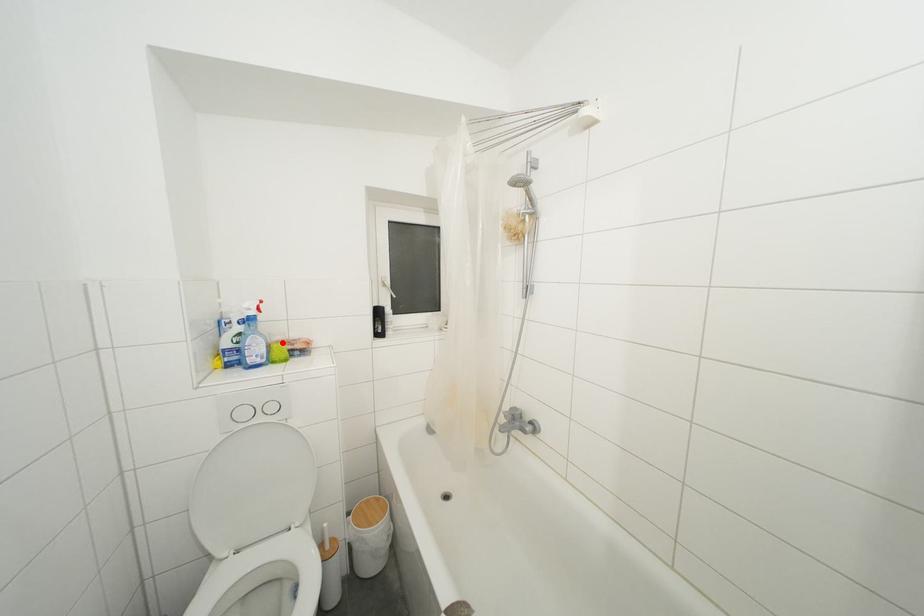
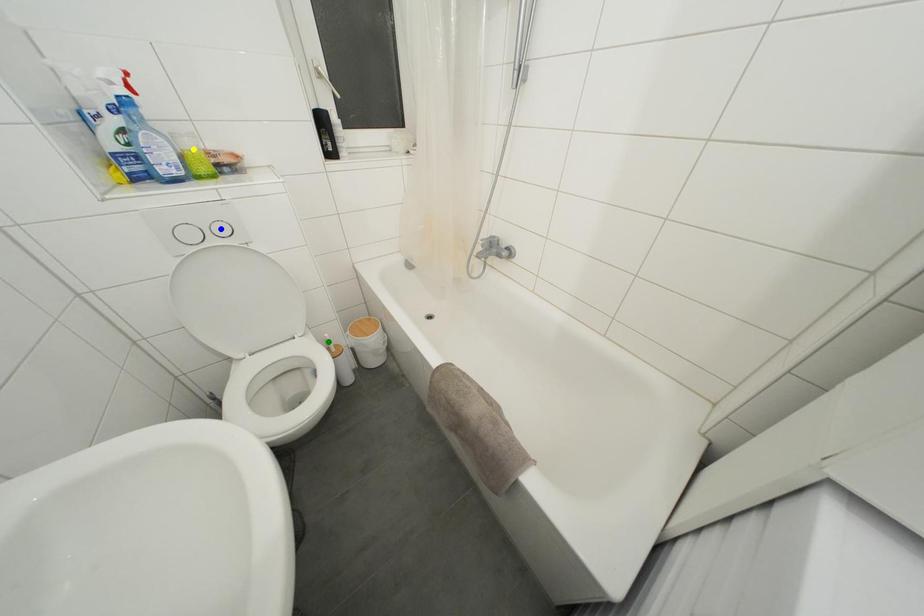
Question: I am providing you with two images of the same scene from different viewpoints. A red point is marked on the first image. You are given multiple points on the second image. Which mark in image 2 goes with the point in image 1?

Choices:
 (A) blue point
 (B) green point
 (C) yellow point

Answer: (C)